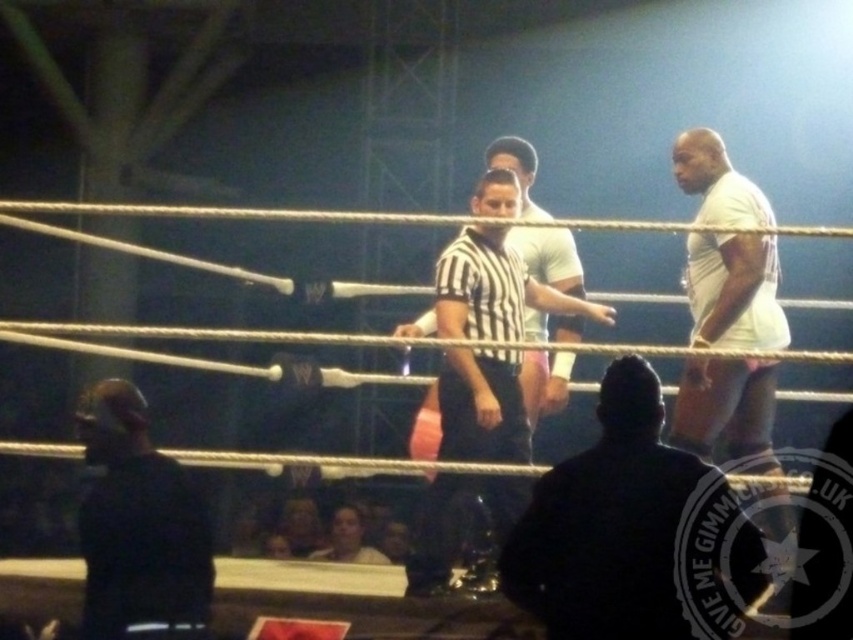
You are a stagehand preparing to set up a camera on the wrestling ring floor. The camera requires a minimum of 40 inches of space between the two subjects to avoid obstruction. Based on the scene, will the camera be able to capture both the dark gray suit at center and the white matte shirt at right without any obstruction?

The distance between the dark gray suit at center and the white matte shirt at right is 39.03 inches, which is less than the required 40 inches. Therefore, the camera may not capture both subjects without obstruction due to insufficient space.